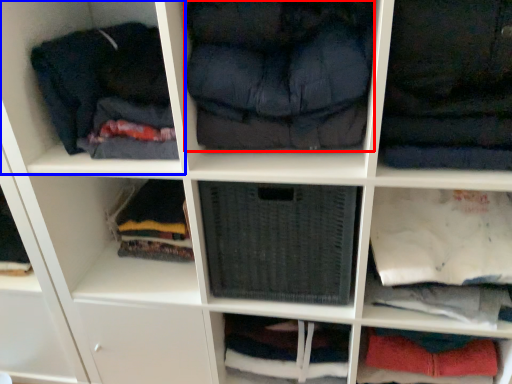
Question: Among these objects, which one is nearest to the camera, clothing (highlighted by a red box) or shelf (highlighted by a blue box)?

Choices:
 (A) clothing
 (B) shelf

Answer: (A)